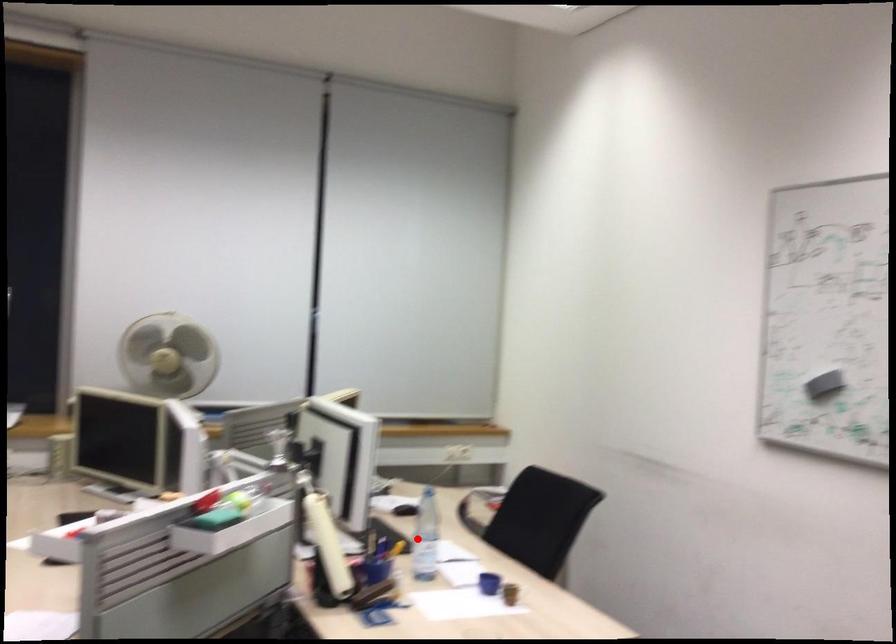
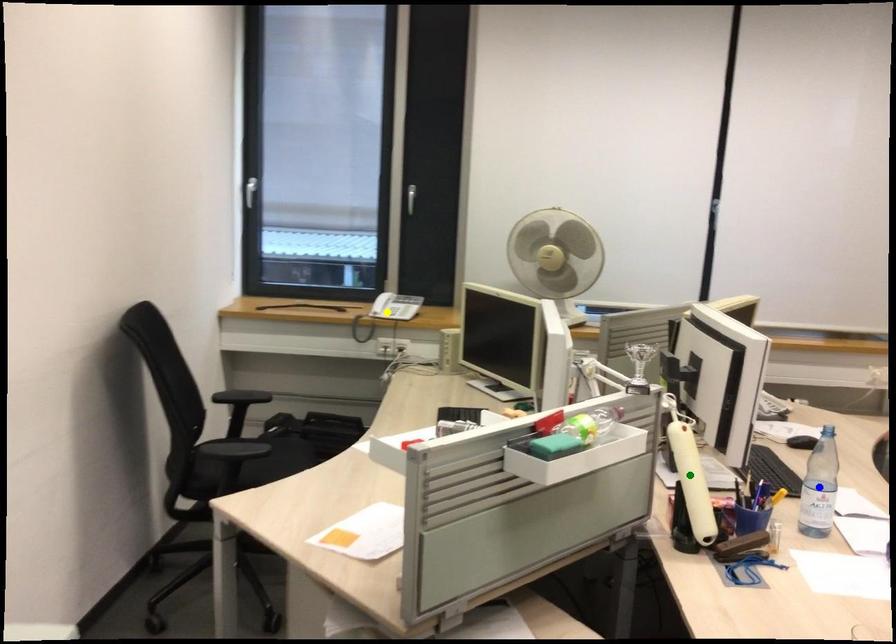
Question: I am providing you with two images of the same scene from different viewpoints. A red point is marked on the first image. You are given multiple points on the second image. Which mark in image 2 goes with the point in image 1?

Choices:
 (A) yellow point
 (B) green point
 (C) blue point

Answer: (C)